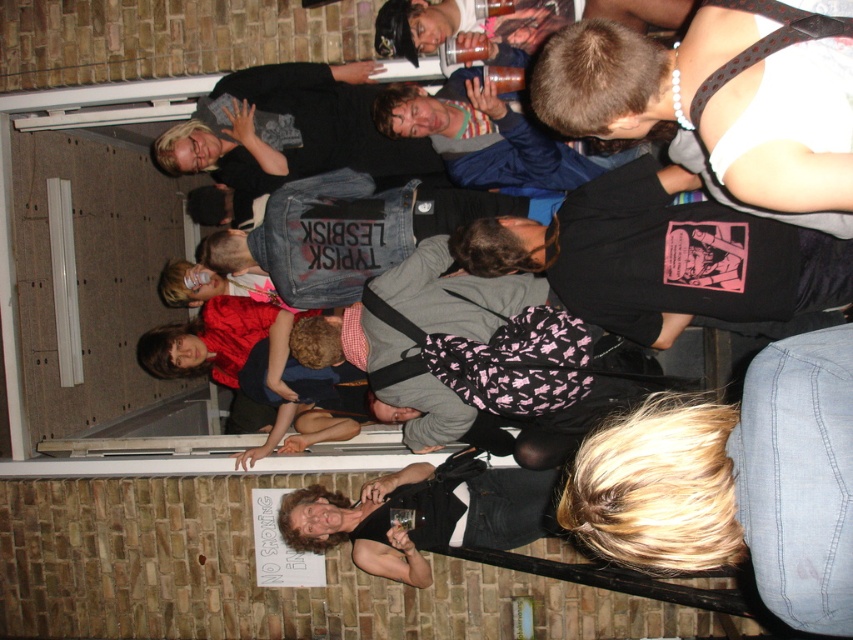
You are a photographer at this event and need to capture a clear photo of both the black denim shirt at upper right and the denim jacket at center. Given that your camera has a minimum focus distance of 5 feet, will you be able to take the photo without moving either subject?

The distance between the black denim shirt at upper right and the denim jacket at center is 5.44 feet, which is greater than the camera minimum focus distance of 5 feet. Therefore, the photographer can capture both subjects clearly without moving them.

You are at the center of the crowd and want to move towards the exit located at the far right corner of the room. There is a denim jacket at center in your way. Can you move around it without stepping on anyone?

The denim jacket at center is located at point (349, 232), so yes, you can move around it by going to the right side of the denim jacket at center since the exit is at the far right corner.